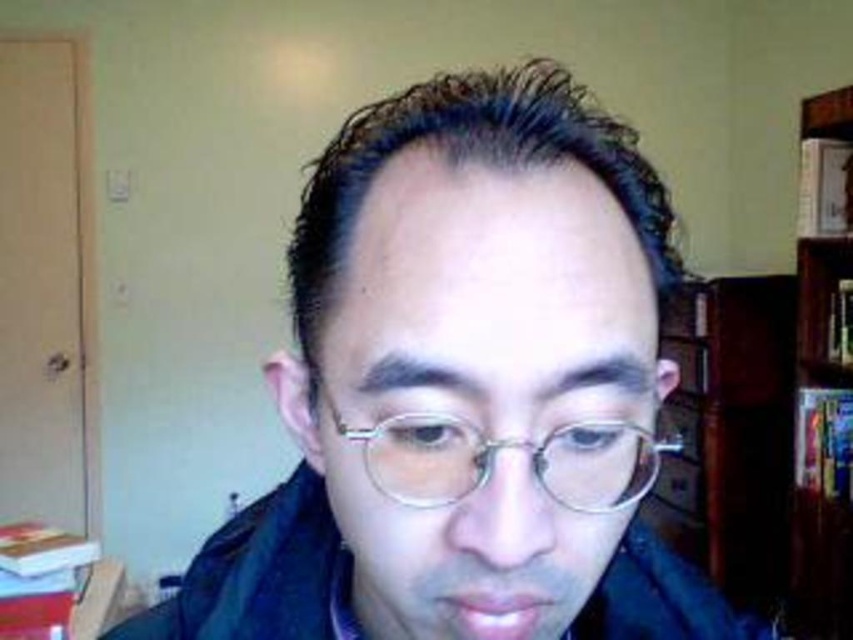
Does clear plastic glasses at center have a larger size compared to wooden bookcase at right?

Incorrect, clear plastic glasses at center is not larger than wooden bookcase at right.

Locate an element on the screen. This screenshot has height=640, width=853. clear plastic glasses at center is located at coordinates (508, 448).

This screenshot has width=853, height=640. I want to click on clear plastic glasses at center, so click(x=508, y=448).

Is point (460, 472) positioned before point (427, 436)?

No, it is not.

Between matte black glasses at center and clear plastic glasses at center, which one has more height?

matte black glasses at center is taller.

What do you see at coordinates (465, 387) in the screenshot? I see `matte black glasses at center` at bounding box center [465, 387].

This screenshot has height=640, width=853. I want to click on matte black glasses at center, so [465, 387].

Can you confirm if matte black glasses at center is thinner than wooden bookcase at right?

No, matte black glasses at center is not thinner than wooden bookcase at right.

Which of these two, matte black glasses at center or wooden bookcase at right, stands shorter?

With less height is matte black glasses at center.

Which is in front, point (318, 160) or point (817, 250)?

Point (318, 160) is in front.

Image resolution: width=853 pixels, height=640 pixels. Identify the location of matte black glasses at center. (465, 387).